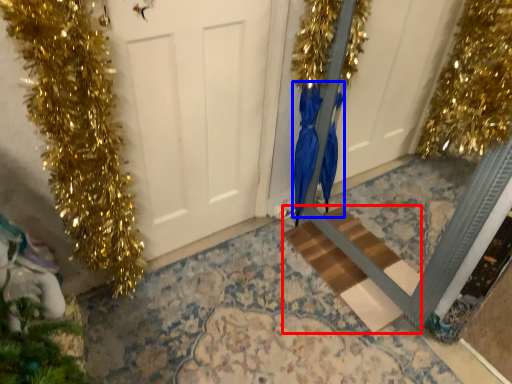
Question: Among these objects, which one is nearest to the camera, stairwell (highlighted by a red box) or dress (highlighted by a blue box)?

Choices:
 (A) stairwell
 (B) dress

Answer: (B)